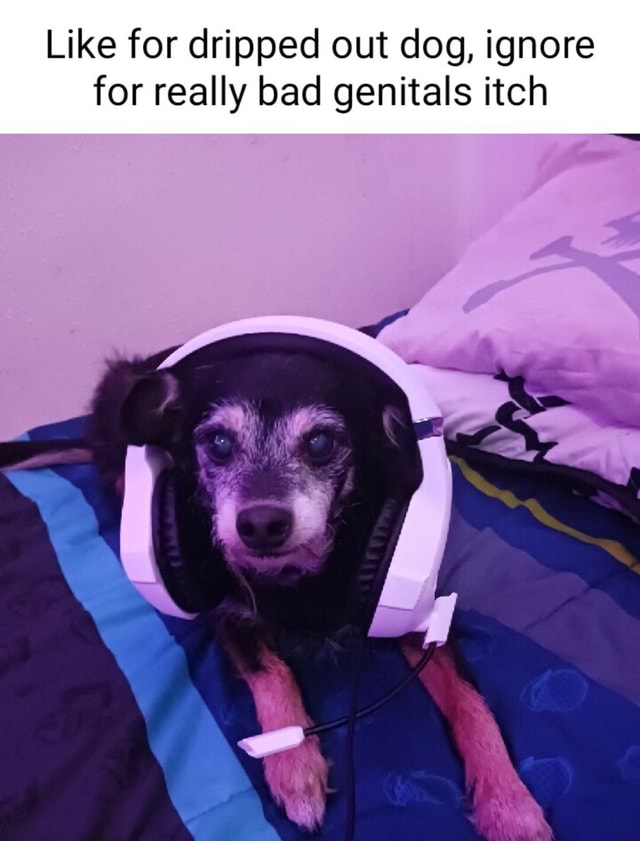
Image resolution: width=640 pixels, height=841 pixels. Find the location of `wall`. wall is located at coordinates (211, 274).